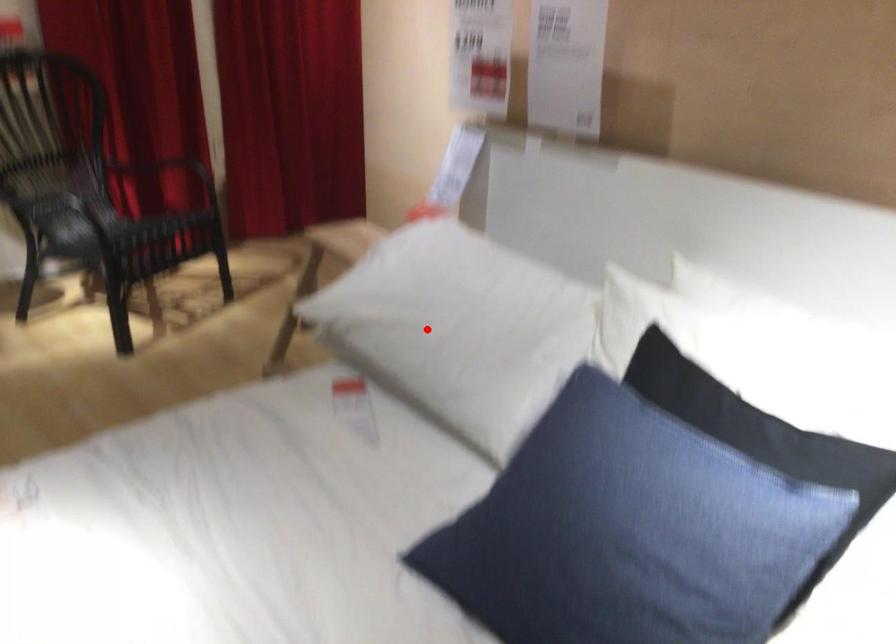
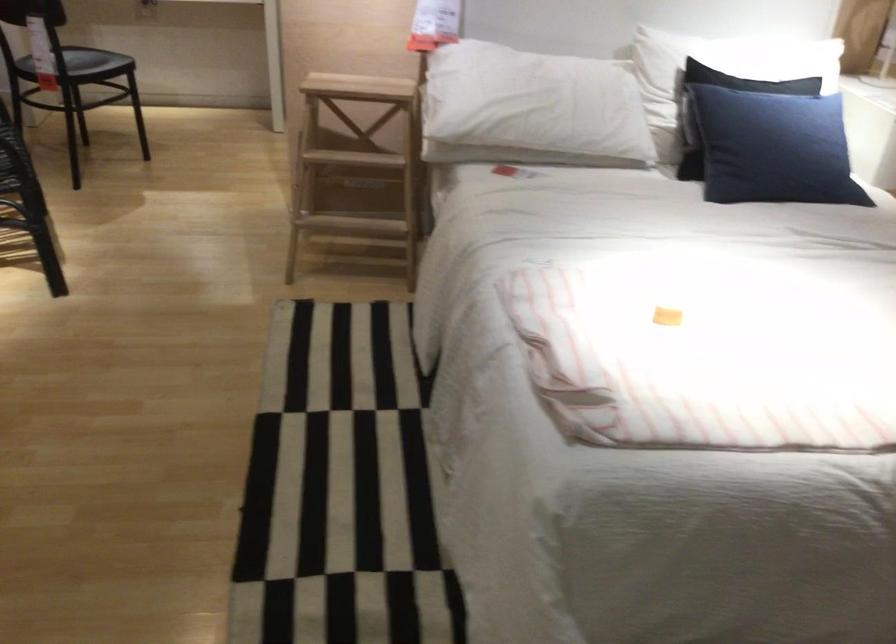
Locate, in the second image, the point that corresponds to the highlighted location in the first image.

(531, 108)